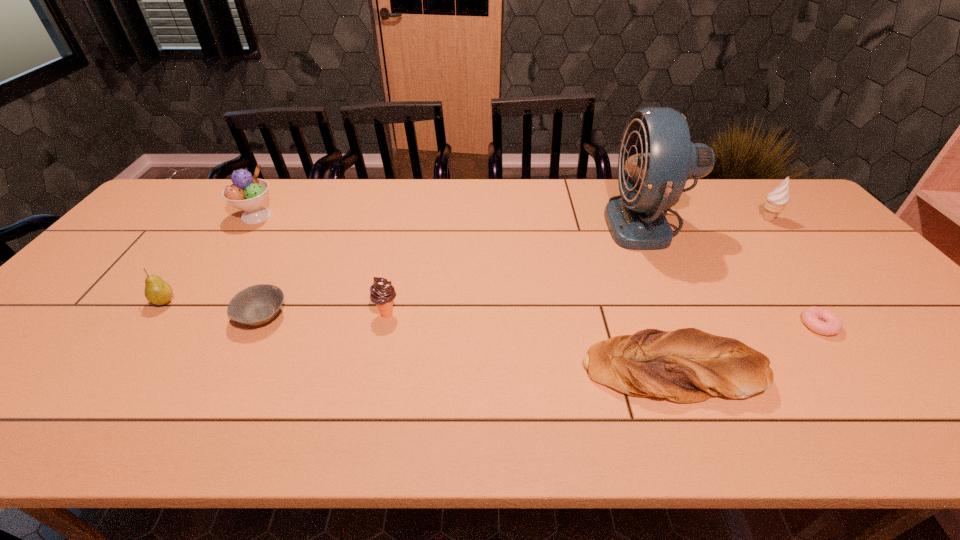
In order to click on vacant position at the right edge of the desktop in this screenshot , I will do `click(944, 386)`.

This screenshot has width=960, height=540. I want to click on vacant area between the tallest object and the leftmost icecream, so click(451, 220).

Find the location of `free space between the rightmost object and the fifth shortest object`. free space between the rightmost object and the fifth shortest object is located at coordinates (577, 267).

At what (x,y) coordinates should I click in order to perform the action: click on unoccupied position between the rightmost icecream and the bread. Please return your answer as a coordinate pair (x, y). This screenshot has height=540, width=960. Looking at the image, I should click on (719, 294).

The height and width of the screenshot is (540, 960). In order to click on vacant point located between the tallest object and the second icecream from left to right in this screenshot , I will do `click(516, 268)`.

I want to click on vacant area that lies between the sixth tallest object and the rightmost object, so click(719, 294).

Image resolution: width=960 pixels, height=540 pixels. What are the coordinates of `vacant area that lies between the seventh tallest object and the rightmost object` in the screenshot? It's located at (515, 268).

Where is `unoccupied position between the fourth tallest object and the fan`? unoccupied position between the fourth tallest object and the fan is located at coordinates (516, 268).

You are a GUI agent. You are given a task and a screenshot of the screen. Output one action in this format:
    pyautogui.click(x=<x>, y=<y>)
    Task: Click on the free space between the bread and the fourth object from left to right
    This screenshot has height=540, width=960.
    Given the screenshot: What is the action you would take?
    pyautogui.click(x=529, y=341)

Locate an element on the screen. This screenshot has height=540, width=960. free space between the bowl and the fourth object from left to right is located at coordinates (324, 315).